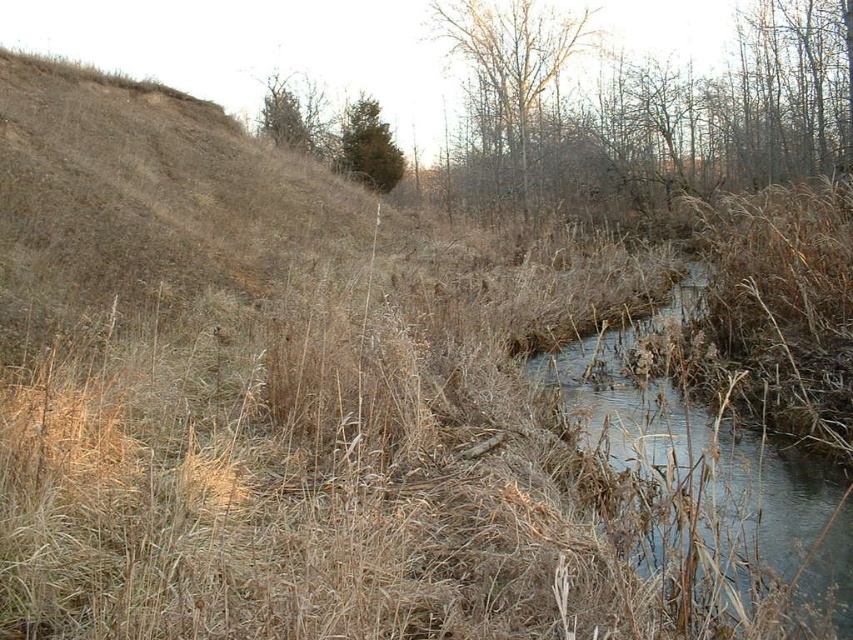
You are an ornithologist observing the scene. You notice two trees at the upper center of the image. Which one is closer to you, the bare branches at upper center or the green matte tree at upper center?

The bare branches at upper center is closer to you because it is in front of the green matte tree at upper center.

You are standing in the middle of the stream and want to reach both the point at coordinates (479,26) and the point at coordinates (341,160). Which point is closer to you?

The point at coordinates (479,26) is closer to you because it is further to the viewer than the point at coordinates (341,160).